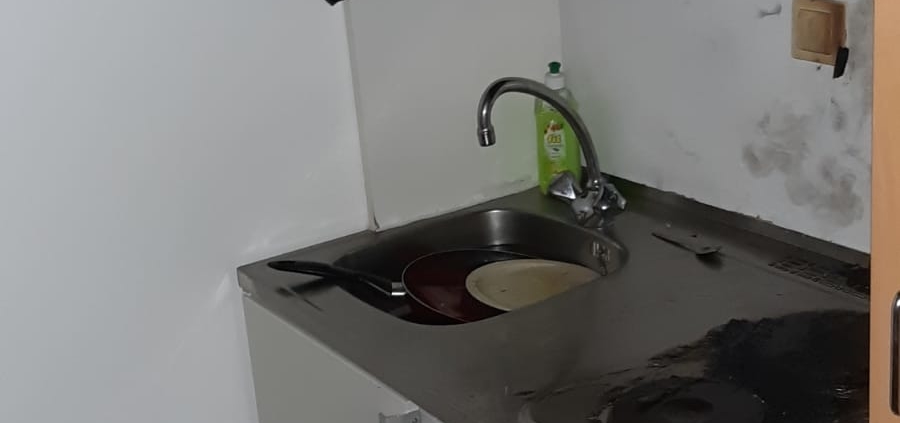
Identify the location of sink. (507, 237).